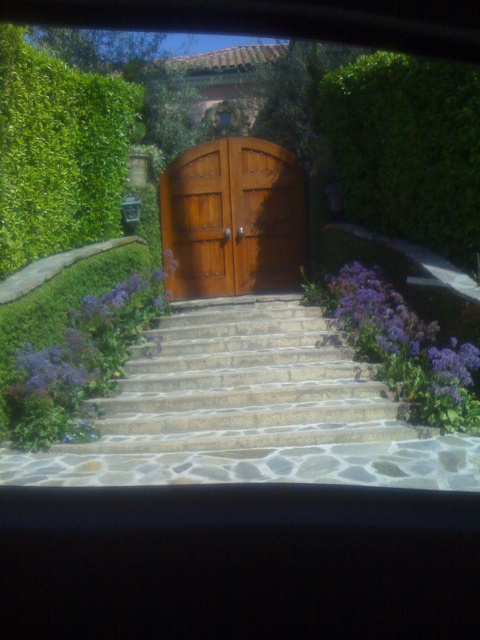
You are standing at the point marked as point (35,234) and want to take a photo of the wooden gate. If your camera has a maximum focus range of 7 meters, will it be able to focus on the gate?

The distance between point (35,234) and the camera is 7.24 meters, which exceeds the camera maximum focus range of 7 meters. Therefore, the camera will not be able to focus on the gate.